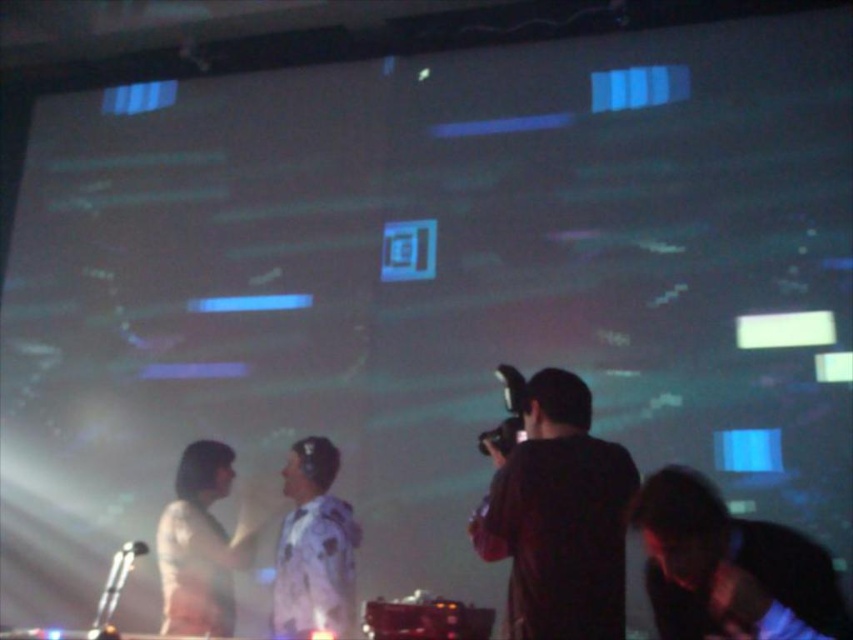
Who is lower down, black matte camera at lower right or white matte shirt at center?

white matte shirt at center

Measure the distance between black matte camera at lower right and white matte shirt at center.

black matte camera at lower right is 5.61 feet away from white matte shirt at center.

Does point (813, 634) come closer to viewer compared to point (199, 477)?

Yes, point (813, 634) is closer to viewer.

This screenshot has width=853, height=640. I want to click on black matte camera at lower right, so click(x=728, y=564).

Does black matte camera at center have a lesser height compared to white matte jacket at center?

Incorrect, black matte camera at center's height does not fall short of white matte jacket at center's.

Between point (521, 563) and point (289, 573), which one is positioned in front?

Point (521, 563) is more forward.

Which is in front, point (534, 410) or point (276, 572)?

Positioned in front is point (534, 410).

Find the location of a particular element. The width and height of the screenshot is (853, 640). black matte camera at center is located at coordinates (560, 516).

Who is shorter, white matte jacket at center or white matte shirt at center?

white matte jacket at center is shorter.

Can you confirm if white matte jacket at center is thinner than white matte shirt at center?

Indeed, white matte jacket at center has a lesser width compared to white matte shirt at center.

Which is in front, point (296, 513) or point (227, 541)?

Point (296, 513)

You are a GUI agent. You are given a task and a screenshot of the screen. Output one action in this format:
    pyautogui.click(x=<x>, y=<y>)
    Task: Click on the white matte jacket at center
    Image resolution: width=853 pixels, height=640 pixels.
    Given the screenshot: What is the action you would take?
    pyautogui.click(x=314, y=547)